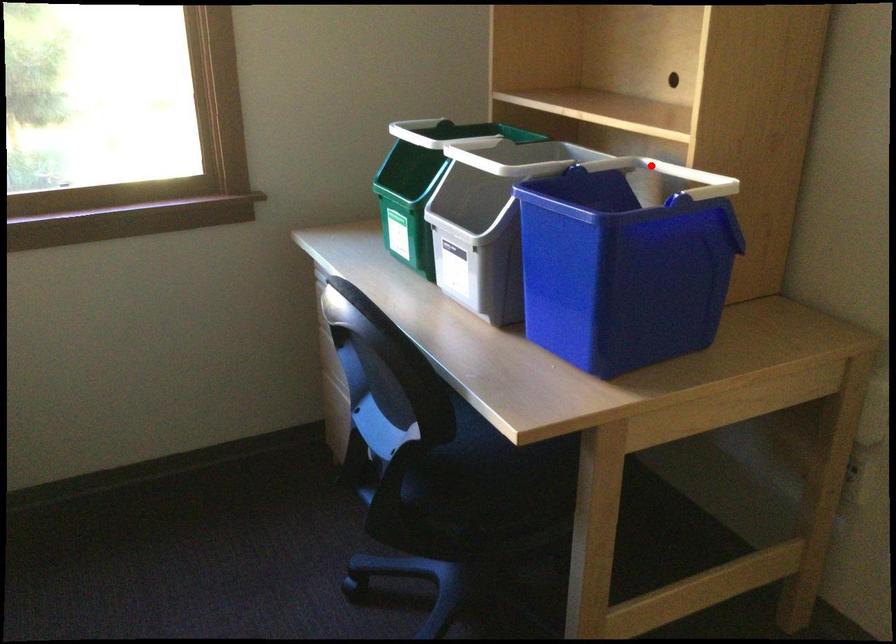
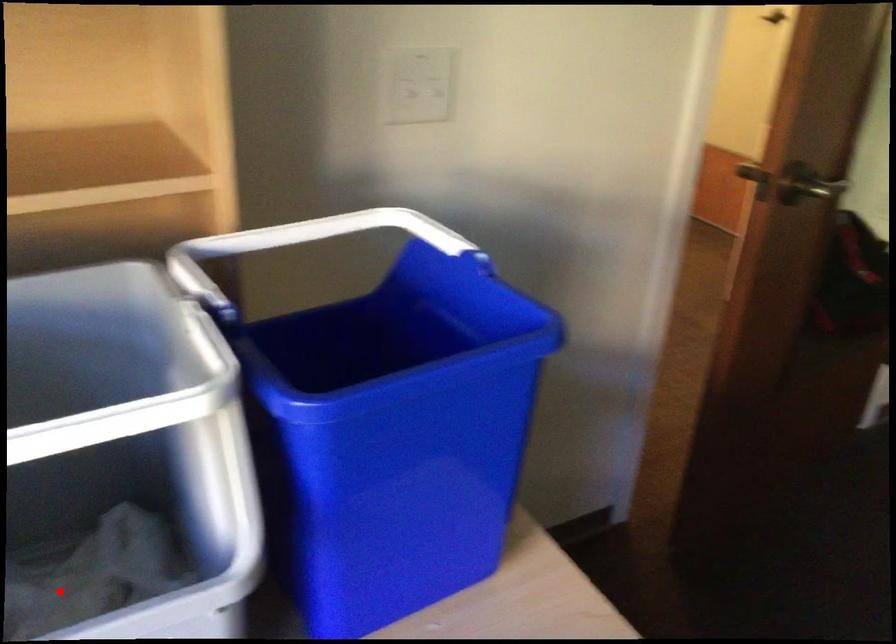
I am providing you with two images of the same scene from different viewpoints. A red point is marked on the first image and another point is marked on the second image. Do the highlighted points in image1 and image2 indicate the same real-world spot?

No